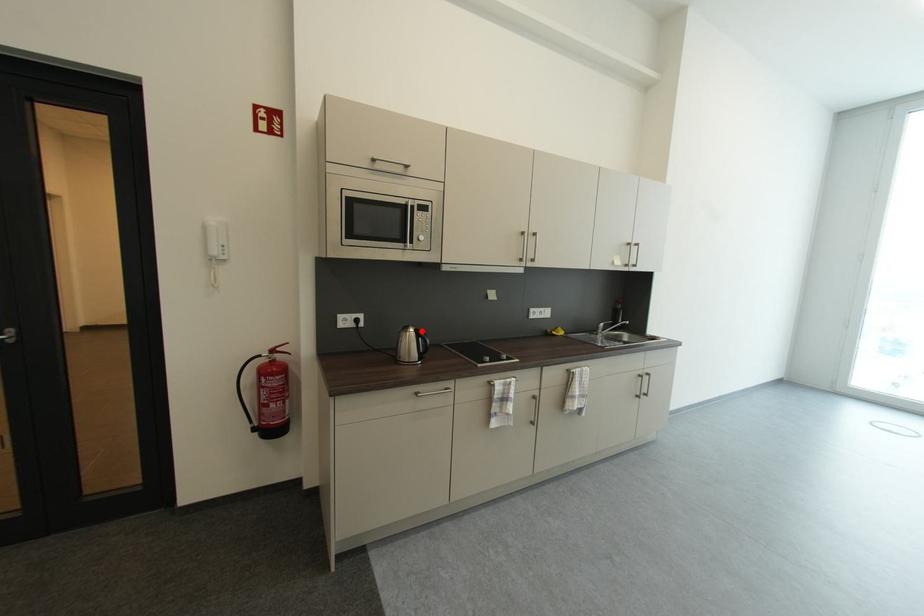
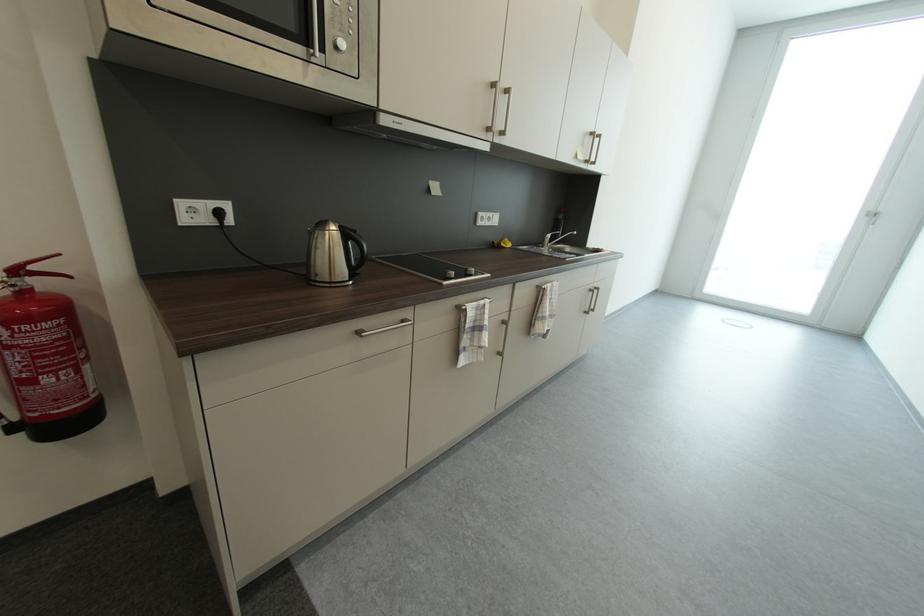
Find the pixel in the second image that matches the highlighted location in the first image.

(346, 228)